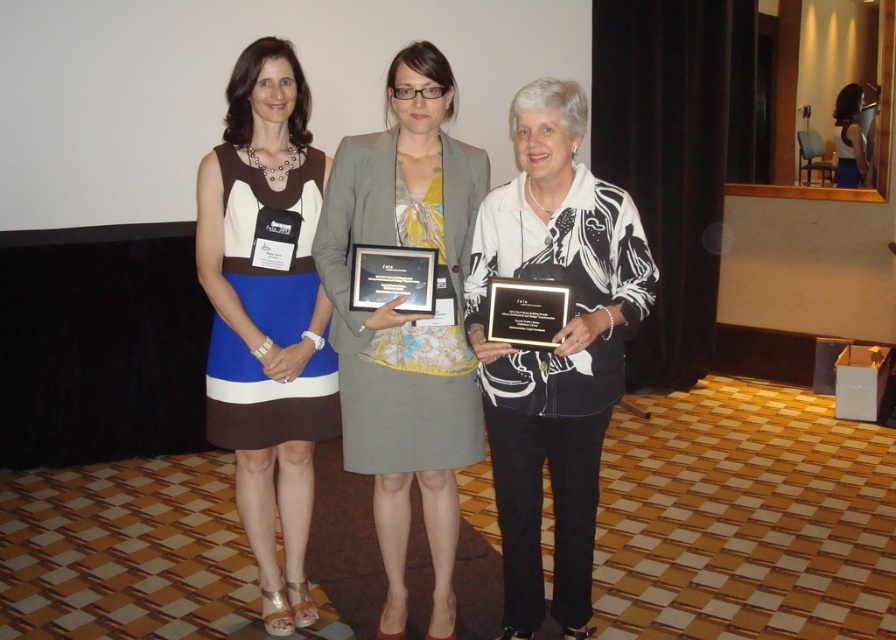
Between matte gray skirt at center and blue fabric dress at left, which one has less height?

With less height is matte gray skirt at center.

Is matte gray skirt at center to the right of blue fabric dress at left from the viewer's perspective?

Correct, you'll find matte gray skirt at center to the right of blue fabric dress at left.

Who is more distant from viewer, (382,173) or (304,602)?

The point (304,602) is behind.

I want to click on matte gray skirt at center, so click(x=407, y=323).

Is white printed fabric at center positioned in front of blue fabric dress at left?

That is True.

Does white printed fabric at center have a greater width compared to blue fabric dress at left?

Correct, the width of white printed fabric at center exceeds that of blue fabric dress at left.

The height and width of the screenshot is (640, 896). What do you see at coordinates (553, 348) in the screenshot?
I see `white printed fabric at center` at bounding box center [553, 348].

Find the location of a particular element. white printed fabric at center is located at coordinates (553, 348).

Who is more forward, [582,376] or [373,429]?

Point [582,376]

Can you confirm if white printed fabric at center is bigger than matte gray skirt at center?

Yes.

What do you see at coordinates (553, 348) in the screenshot? This screenshot has height=640, width=896. I see `white printed fabric at center` at bounding box center [553, 348].

Identify the location of white printed fabric at center. The width and height of the screenshot is (896, 640). (553, 348).